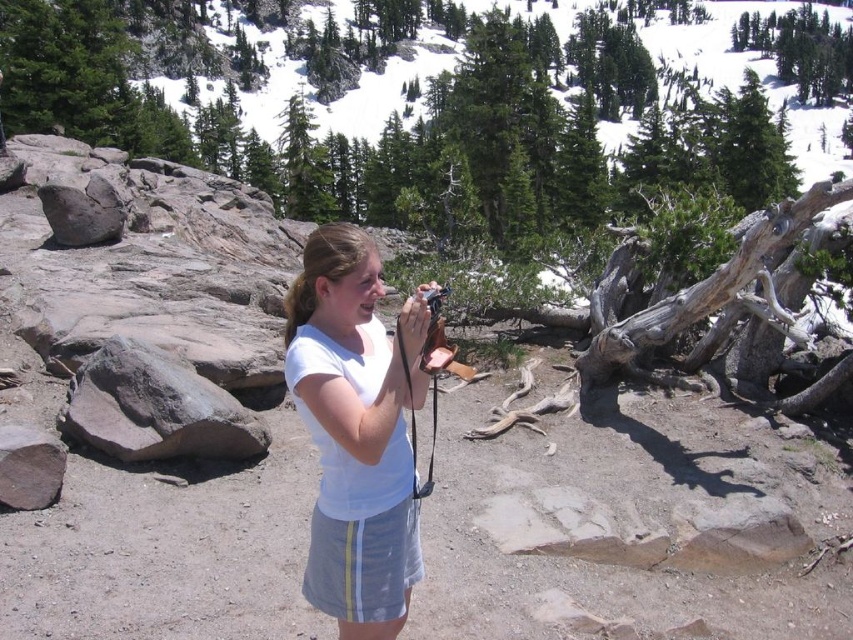
Question: Which is nearer to the gray rock at left?

Choices:
 (A) white cotton shirt at center
 (B) smooth gray rock at left

Answer: (A)

Question: Is gray rock at left thinner than smooth gray rock at left?

Choices:
 (A) yes
 (B) no

Answer: (B)

Question: Can you confirm if white cotton shirt at center is thinner than gray rock at left?

Choices:
 (A) no
 (B) yes

Answer: (B)

Question: Among these points, which one is nearest to the camera?

Choices:
 (A) (119, 449)
 (B) (67, 173)
 (C) (334, 500)

Answer: (C)

Question: Which object is farther from the camera taking this photo?

Choices:
 (A) gray rock at left
 (B) smooth gray rock at left

Answer: (B)

Question: Can you confirm if gray rock at left is positioned to the left of smooth gray rock at left?

Choices:
 (A) yes
 (B) no

Answer: (B)